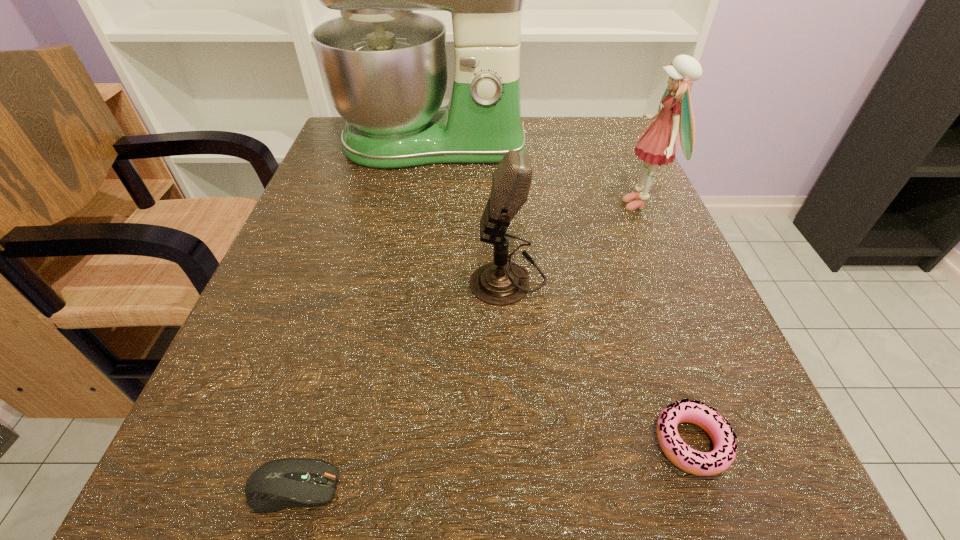
You are a GUI agent. You are given a task and a screenshot of the screen. Output one action in this format:
    pyautogui.click(x=<x>, y=<y>)
    Task: Click on the mixer situated at the left edge
    The image size is (960, 540).
    Given the screenshot: What is the action you would take?
    pyautogui.click(x=384, y=67)

This screenshot has height=540, width=960. What are the coordinates of `computer equipment that is at the left edge` in the screenshot? It's located at (278, 484).

Where is `doll that is at the right edge`? This screenshot has height=540, width=960. doll that is at the right edge is located at coordinates (659, 143).

Locate an element on the screen. This screenshot has width=960, height=540. doughnut positioned at the right edge is located at coordinates (689, 460).

I want to click on object that is at the far left corner, so click(384, 67).

The width and height of the screenshot is (960, 540). What are the coordinates of `object that is positioned at the near left corner` in the screenshot? It's located at (278, 484).

Identify the location of object that is at the near right corner. This screenshot has height=540, width=960. (689, 460).

Where is `vacant space at the far edge of the desktop`? vacant space at the far edge of the desktop is located at coordinates (543, 123).

This screenshot has width=960, height=540. What are the coordinates of `vacant space at the near edge of the desktop` in the screenshot? It's located at (351, 523).

You are a GUI agent. You are given a task and a screenshot of the screen. Output one action in this format:
    pyautogui.click(x=<x>, y=<y>)
    Task: Click on the free location at the left edge
    The image size is (960, 540).
    Given the screenshot: What is the action you would take?
    pyautogui.click(x=380, y=178)